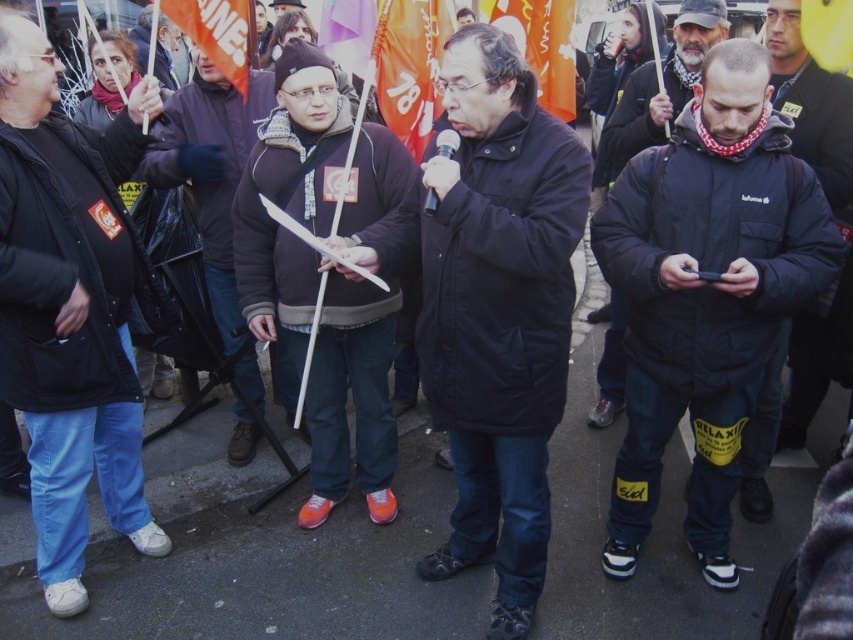
Between point (692, 72) and point (235, 29), which one is positioned in front?

Point (235, 29) is more forward.

Between point (608, 147) and point (190, 33), which one is positioned behind?

Point (608, 147)

What do you see at coordinates (659, 88) in the screenshot? The height and width of the screenshot is (640, 853). I see `black matte jacket at lower right` at bounding box center [659, 88].

Locate an element on the screen. black matte jacket at lower right is located at coordinates (659, 88).

Which of these two, matte black coat at center or orange fabric flag at center, stands shorter?

orange fabric flag at center is shorter.

Is matte black coat at center positioned at the back of orange fabric flag at center?

No, it is not.

The image size is (853, 640). Identify the location of matte black coat at center. (492, 307).

Find the location of `matte black jacket at left`. matte black jacket at left is located at coordinates (68, 308).

Which is above, matte black jacket at left or dark blue puffer jacket at center?

dark blue puffer jacket at center is higher up.

Which is behind, point (67, 241) or point (773, 60)?

The point (773, 60) is more distant.

The image size is (853, 640). What are the coordinates of `matte black jacket at left` in the screenshot? It's located at (68, 308).